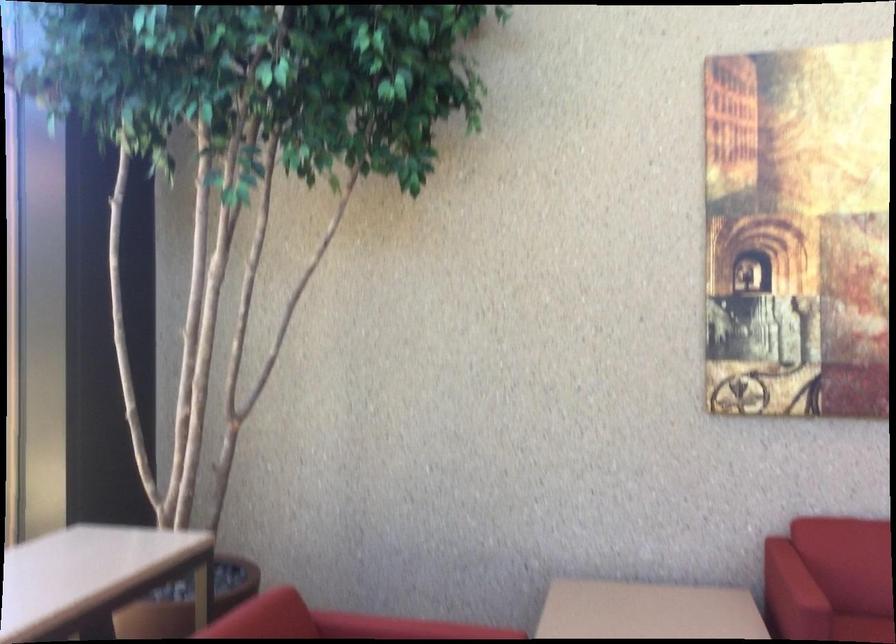
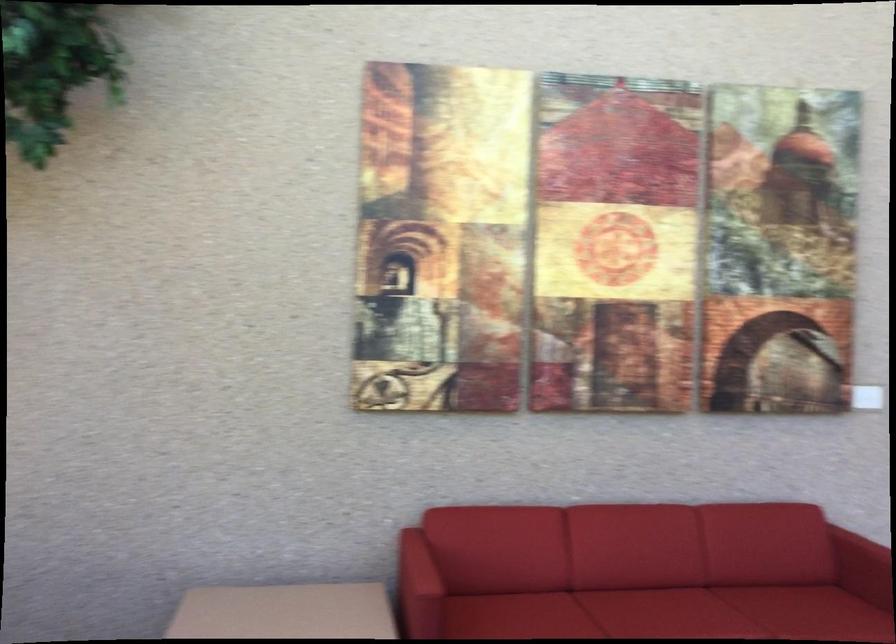
Question: The images are taken continuously from a first-person perspective. In which direction are you moving?

Choices:
 (A) Left
 (B) Right
 (C) Forward
 (D) Backward

Answer: (B)